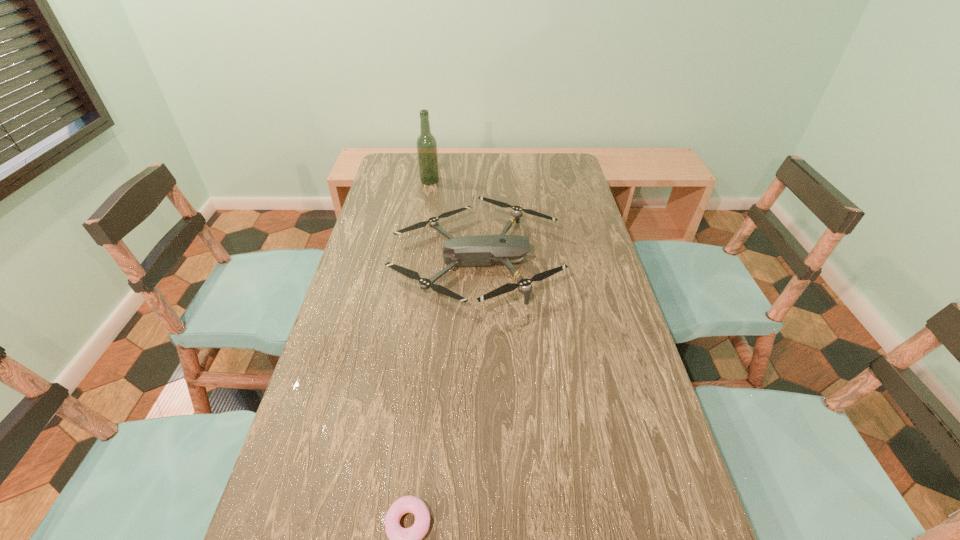
Where is `object at the far left corner`? The image size is (960, 540). object at the far left corner is located at coordinates (426, 143).

I want to click on free space at the far edge of the desktop, so click(x=485, y=162).

What are the coordinates of `blank area at the left edge` in the screenshot? It's located at (388, 303).

Find the location of `vacant space at the right edge of the desktop`. vacant space at the right edge of the desktop is located at coordinates (617, 420).

Identify the location of free space at the far left corner of the desktop. (414, 154).

The image size is (960, 540). Identify the location of vacant space at the far right corner. click(564, 181).

Locate an element on the screen. vacant point located between the second nearest object and the tallest object is located at coordinates (452, 221).

You are a GUI agent. You are given a task and a screenshot of the screen. Output one action in this format:
    pyautogui.click(x=<x>, y=<y>)
    Task: Click on the vacant area that lies between the second tallest object and the farthest object
    The image size is (960, 540).
    Given the screenshot: What is the action you would take?
    pyautogui.click(x=452, y=221)

This screenshot has height=540, width=960. Find the location of `free area in between the second farthest object and the liquor`. free area in between the second farthest object and the liquor is located at coordinates (452, 221).

You are a GUI agent. You are given a task and a screenshot of the screen. Output one action in this format:
    pyautogui.click(x=<x>, y=<y>)
    Task: Click on the object that stands as the closest to the nearest object
    Image resolution: width=960 pixels, height=540 pixels.
    Given the screenshot: What is the action you would take?
    481,250